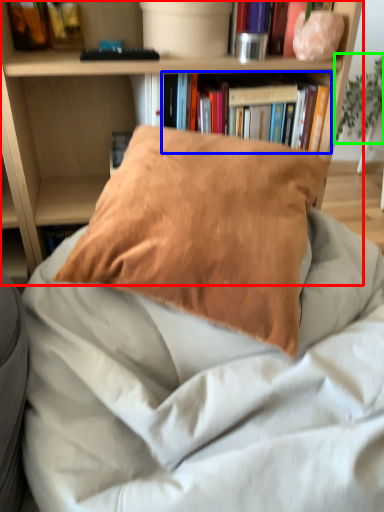
Question: Considering the real-world distances, which object is closest to bookcase (highlighted by a red box)? book (highlighted by a blue box) or plant (highlighted by a green box).

Choices:
 (A) book
 (B) plant

Answer: (A)